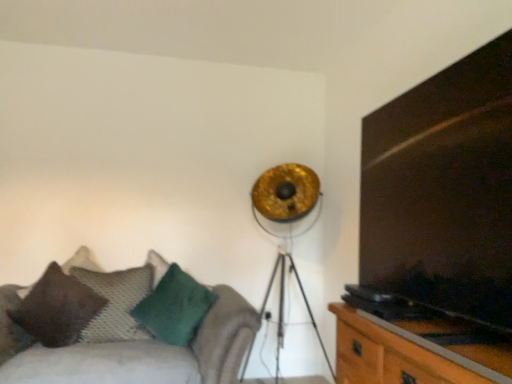
I want to click on wooden cabinet at right, so click(x=393, y=354).

You are a GUI agent. You are given a task and a screenshot of the screen. Output one action in this format:
    pyautogui.click(x=<x>, y=<y>)
    Task: Click on the green fuzzy pillow at lower left, the 1th pillow from the right
    This screenshot has width=512, height=384.
    Given the screenshot: What is the action you would take?
    pyautogui.click(x=175, y=307)

Can you confirm if brown textured pillow at lower left, the first pillow viewed from the left, is shorter than velvet green cushion at lower left?

Correct, brown textured pillow at lower left, the first pillow viewed from the left, is not as tall as velvet green cushion at lower left.

How far apart are brown textured pillow at lower left, the first pillow viewed from the left, and velvet green cushion at lower left?

brown textured pillow at lower left, the first pillow viewed from the left, is 13.52 inches away from velvet green cushion at lower left.

Consider the image. What's the angular difference between brown textured pillow at lower left, the first pillow viewed from the left, and velvet green cushion at lower left's facing directions?

There is a 6.01-degree angle between the facing directions of brown textured pillow at lower left, the first pillow viewed from the left, and velvet green cushion at lower left.

From a real-world perspective, which object rests below the other?

velvet green cushion at lower left is physically lower.

Is wooden cabinet at right placed right next to brown textured pillow at lower left, the first pillow viewed from the left?

No, wooden cabinet at right is not beside brown textured pillow at lower left, the first pillow viewed from the left.

Is wooden cabinet at right aimed at brown textured pillow at lower left, positioned as the third pillow in right-to-left order?

No, wooden cabinet at right is not aimed at brown textured pillow at lower left, positioned as the third pillow in right-to-left order.

This screenshot has width=512, height=384. What are the coordinates of `pillow located above the wooden cabinet at right (from the image's perspective)` in the screenshot? It's located at (57, 308).

Is gold metallic tripod lamp at upper center facing towards wooden cabinet at right?

No, gold metallic tripod lamp at upper center is not oriented towards wooden cabinet at right.

Considering the sizes of objects gold metallic tripod lamp at upper center and wooden cabinet at right in the image provided, who is shorter, gold metallic tripod lamp at upper center or wooden cabinet at right?

With less height is wooden cabinet at right.

Based on the photo, between gold metallic tripod lamp at upper center and wooden cabinet at right, which one has larger size?

With larger size is gold metallic tripod lamp at upper center.

Is the position of gold metallic tripod lamp at upper center less distant than that of wooden cabinet at right?

That is False.

Considering the sizes of objects dark wood entertainment center at right and knitted fabric pillow at left, the 2th pillow when ordered from left to right, in the image provided, who is thinner, dark wood entertainment center at right or knitted fabric pillow at left, the 2th pillow when ordered from left to right,?

knitted fabric pillow at left, the 2th pillow when ordered from left to right, is thinner.

Considering their positions, is dark wood entertainment center at right located in front of or behind knitted fabric pillow at left, the second pillow from the right?

dark wood entertainment center at right is positioned closer to the viewer than knitted fabric pillow at left, the second pillow from the right.

From a real-world perspective, relative to knitted fabric pillow at left, the second pillow from the right, is dark wood entertainment center at right vertically above or below?

In terms of real-world spatial position, dark wood entertainment center at right is above knitted fabric pillow at left, the second pillow from the right.

How many degrees apart are the facing directions of wooden cabinet at right and dark wood entertainment center at right?

They differ by 0.311 degrees in their facing directions.

Do you think wooden cabinet at right is within dark wood entertainment center at right, or outside of it?

wooden cabinet at right is not inside dark wood entertainment center at right, it's outside.

Is dark wood entertainment center at right at the back of wooden cabinet at right?

wooden cabinet at right does not have its back to dark wood entertainment center at right.

From a real-world perspective, relative to dark wood entertainment center at right, is wooden cabinet at right vertically above or below?

wooden cabinet at right is situated lower than dark wood entertainment center at right in the real world.

Does point (196, 320) come behind point (100, 282)?

That is False.

Considering the sizes of objects green fuzzy pillow at lower left, the 1th pillow from the right, and knitted fabric pillow at left, the 2th pillow when ordered from left to right, in the image provided, who is shorter, green fuzzy pillow at lower left, the 1th pillow from the right, or knitted fabric pillow at left, the 2th pillow when ordered from left to right,?

Standing shorter between the two is green fuzzy pillow at lower left, the 1th pillow from the right.

Would you say green fuzzy pillow at lower left, the 1th pillow from the right, is to the left or to the right of knitted fabric pillow at left, the second pillow from the right, in the picture?

green fuzzy pillow at lower left, the 1th pillow from the right, is to the right of knitted fabric pillow at left, the second pillow from the right.

Which of these two, green fuzzy pillow at lower left, positioned as the 3th pillow in left-to-right order, or knitted fabric pillow at left, the second pillow from the right, is thinner?

knitted fabric pillow at left, the second pillow from the right.

Which is in front, point (298, 213) or point (444, 121)?

The point (444, 121) is closer.

From the image's perspective, is gold metallic tripod lamp at upper center above dark wood entertainment center at right?

No, from the image's perspective, gold metallic tripod lamp at upper center is not on top of dark wood entertainment center at right.

Considering the positions of objects gold metallic tripod lamp at upper center and dark wood entertainment center at right in the image provided, who is behind, gold metallic tripod lamp at upper center or dark wood entertainment center at right?

gold metallic tripod lamp at upper center.

The height and width of the screenshot is (384, 512). There is a velvet green cushion at lower left. Identify the location of the 3rd pillow above it (from a real-world perspective). (57, 308).

Identify the location of table located below the brown textured pillow at lower left, positioned as the third pillow in right-to-left order (from the image's perspective). (393, 354).

From the picture: Estimate the real-world distances between objects in this image. Which object is closer to wooden cabinet at right, velvet green cushion at lower left or green fuzzy pillow at lower left, the 1th pillow from the right?

Among the two, velvet green cushion at lower left is located nearer to wooden cabinet at right.

Based on their spatial positions, is wooden cabinet at right or green fuzzy pillow at lower left, the 1th pillow from the right, closer to velvet green cushion at lower left?

Based on the image, green fuzzy pillow at lower left, the 1th pillow from the right, appears to be nearer to velvet green cushion at lower left.

Which object lies nearer to the anchor point knitted fabric pillow at left, the 2th pillow when ordered from left to right, green fuzzy pillow at lower left, the 1th pillow from the right, or brown textured pillow at lower left, positioned as the third pillow in right-to-left order?

The object closer to knitted fabric pillow at left, the 2th pillow when ordered from left to right, is brown textured pillow at lower left, positioned as the third pillow in right-to-left order.

Considering their positions, is green fuzzy pillow at lower left, the 1th pillow from the right, positioned closer to dark wood entertainment center at right than wooden cabinet at right?

wooden cabinet at right is positioned closer to the anchor dark wood entertainment center at right.

Considering their positions, is dark wood entertainment center at right positioned closer to wooden cabinet at right than brown textured pillow at lower left, positioned as the third pillow in right-to-left order?

dark wood entertainment center at right is closer to wooden cabinet at right.

When comparing their distances from wooden cabinet at right, does dark wood entertainment center at right or velvet green cushion at lower left seem further?

velvet green cushion at lower left is further to wooden cabinet at right.

Looking at the image, which one is located closer to gold metallic tripod lamp at upper center, velvet green cushion at lower left or dark wood entertainment center at right?

velvet green cushion at lower left is closer to gold metallic tripod lamp at upper center.

When comparing their distances from brown textured pillow at lower left, positioned as the third pillow in right-to-left order, does green fuzzy pillow at lower left, the 1th pillow from the right, or knitted fabric pillow at left, the second pillow from the right, seem closer?

knitted fabric pillow at left, the second pillow from the right, is positioned closer to the anchor brown textured pillow at lower left, positioned as the third pillow in right-to-left order.

Identify the location of lamp between wooden cabinet at right and knitted fabric pillow at left, the 2th pillow when ordered from left to right, from front to back. (289, 228).

What are the coordinates of `studio couch located between brown textured pillow at lower left, positioned as the third pillow in right-to-left order, and dark wood entertainment center at right in the left-right direction` in the screenshot? It's located at (147, 354).

Locate an element on the screen. The image size is (512, 384). lamp between brown textured pillow at lower left, positioned as the third pillow in right-to-left order, and dark wood entertainment center at right from left to right is located at coordinates (289, 228).

At what (x,y) coordinates should I click in order to perform the action: click on lamp between wooden cabinet at right and green fuzzy pillow at lower left, positioned as the 3th pillow in left-to-right order, in the front-back direction. Please return your answer as a coordinate pair (x, y). Looking at the image, I should click on [289, 228].